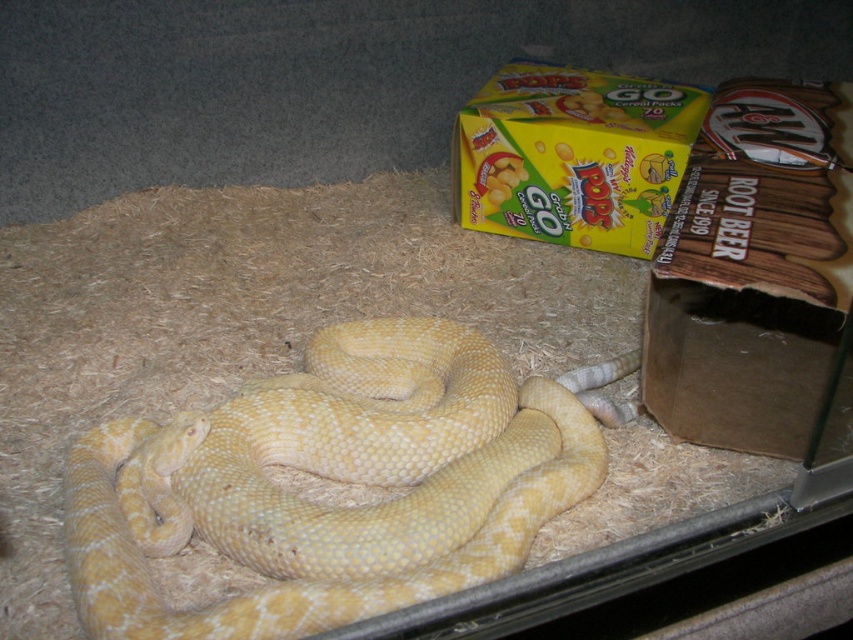
Question: Where is yellow scaly snake at center located in relation to yellow cardboard box at upper right in the image?

Choices:
 (A) above
 (B) below

Answer: (B)

Question: Which point is closer to the camera taking this photo?

Choices:
 (A) (326, 387)
 (B) (619, 90)

Answer: (A)

Question: In this image, where is yellow scaly snake at center located relative to yellow cardboard box at upper right?

Choices:
 (A) left
 (B) right

Answer: (A)

Question: Can you confirm if yellow scaly snake at center is positioned to the left of yellow cardboard box at upper right?

Choices:
 (A) no
 (B) yes

Answer: (B)

Question: Which object is farther from the camera taking this photo?

Choices:
 (A) yellow scaly snake at center
 (B) yellow cardboard box at upper right

Answer: (B)